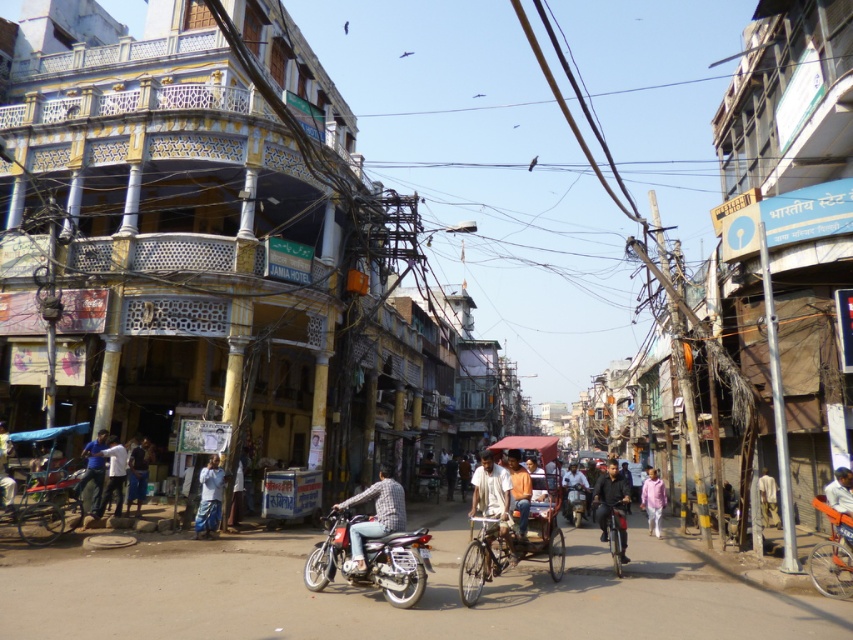
How much distance is there between dark blue jeans at center and pink cotton shirt at center?

dark blue jeans at center and pink cotton shirt at center are 51.89 feet apart.

Between dark blue jeans at center and pink cotton shirt at center, which one appears on the right side from the viewer's perspective?

pink cotton shirt at center is more to the right.

Where is `dark blue jeans at center`? dark blue jeans at center is located at coordinates (137, 474).

Find the location of a particular element. dark blue jeans at center is located at coordinates (137, 474).

Who is positioned more to the left, shiny metallic motorcycle at center or orange cotton shirt at center?

From the viewer's perspective, shiny metallic motorcycle at center appears more on the left side.

Who is lower down, shiny metallic motorcycle at center or orange cotton shirt at center?

shiny metallic motorcycle at center is lower down.

Find the location of a particular element. The width and height of the screenshot is (853, 640). shiny metallic motorcycle at center is located at coordinates (370, 560).

Is light blue jeans at center bigger than shiny chrome motorcycle at center?

No.

Is point (198, 509) positioned before point (587, 492)?

Yes, point (198, 509) is in front of point (587, 492).

The image size is (853, 640). In order to click on light blue jeans at center in this screenshot , I will do `click(209, 497)`.